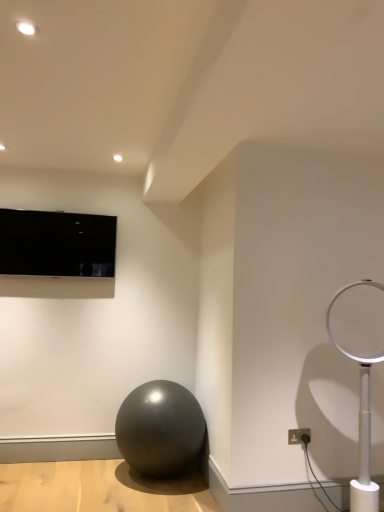
Where is `vacant space underneath matte black tv at upper left (from a real-world perspective)`? vacant space underneath matte black tv at upper left (from a real-world perspective) is located at coordinates pyautogui.click(x=64, y=456).